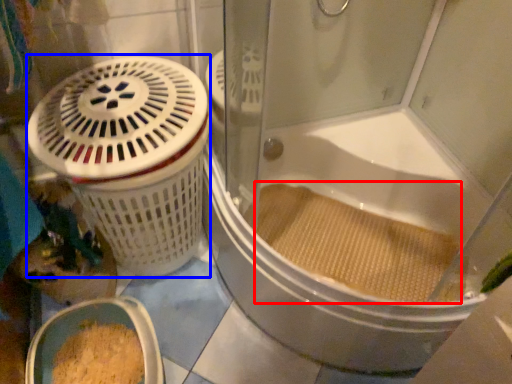
Question: Which object appears closest to the camera in this image, debris (highlighted by a red box) or basket container (highlighted by a blue box)?

Choices:
 (A) debris
 (B) basket container

Answer: (B)